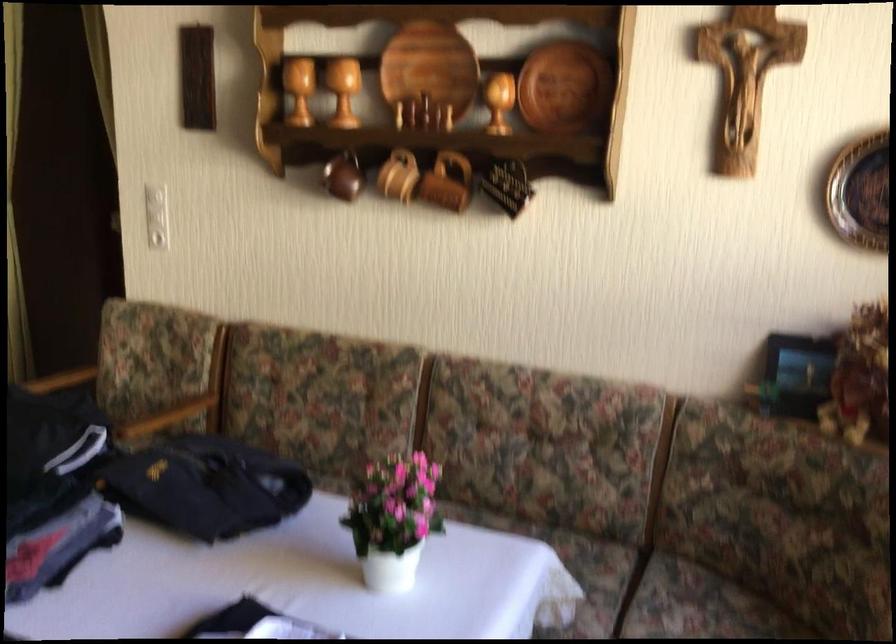
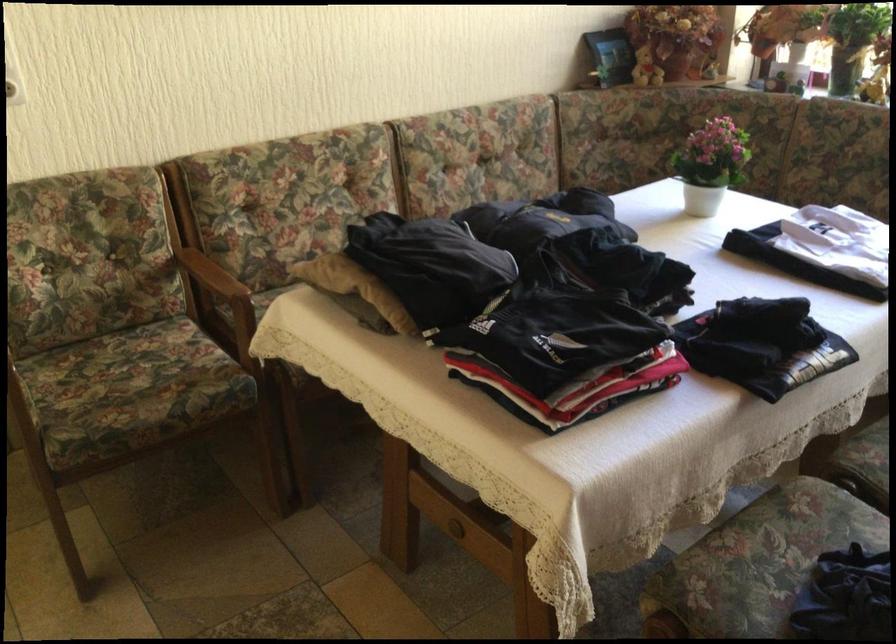
In the second image, find the point that corresponds to [407,524] in the first image.

(711, 164)